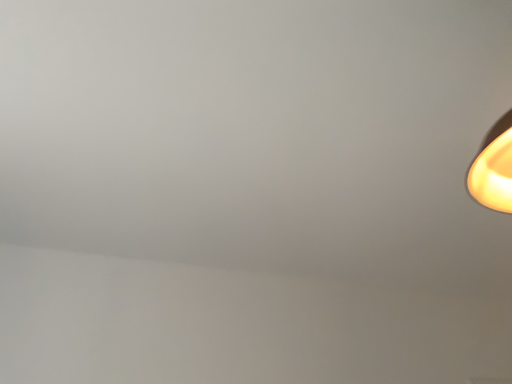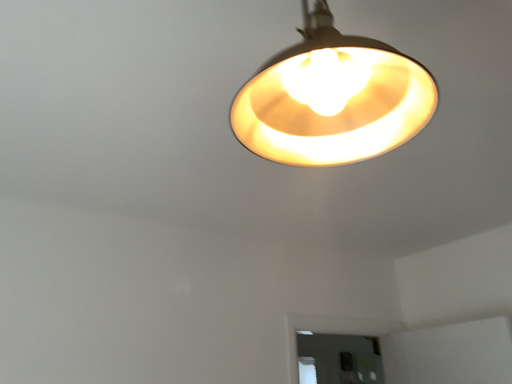
Question: Which way did the camera rotate in the video?

Choices:
 (A) rotated downward
 (B) rotated upward

Answer: (A)